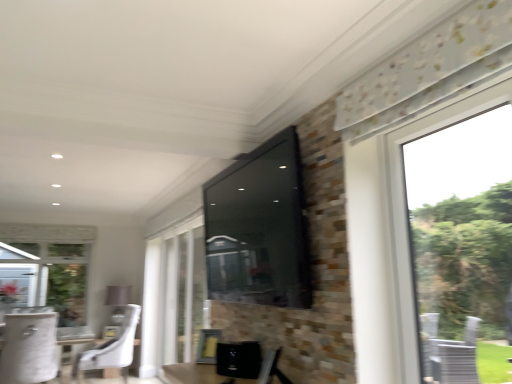
Question: Is transparent glass window at center bigger or smaller than white fabric chair at lower left, which ranks as the second chair in right-to-left order?

Choices:
 (A) small
 (B) big

Answer: (A)

Question: From the image's perspective, relative to white fabric chair at lower left, which ranks as the second chair in right-to-left order, is transparent glass window at center above or below?

Choices:
 (A) below
 (B) above

Answer: (B)

Question: Which is nearer to the matte black tv at upper center?

Choices:
 (A) white fabric chair at lower left, which ranks as the second chair in right-to-left order
 (B) white fabric chair at lower left, the first chair from the right
 (C) white fabric round table at lower left
 (D) transparent glass window at center

Answer: (D)

Question: Estimate the real-world distances between objects in this image. Which object is farther from the white fabric chair at lower left, which ranks as the second chair in right-to-left order?

Choices:
 (A) matte black tv at upper center
 (B) white fabric round table at lower left
 (C) white fabric chair at lower left, the first chair from the right
 (D) transparent glass window at center

Answer: (A)